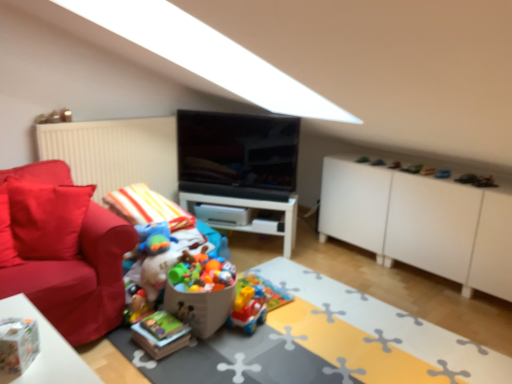
Locate an element on the screen. This screenshot has width=512, height=384. unoccupied region to the right of brightly colored plastic toys at center, which is the 1th toy in left-to-right order is located at coordinates [x=270, y=336].